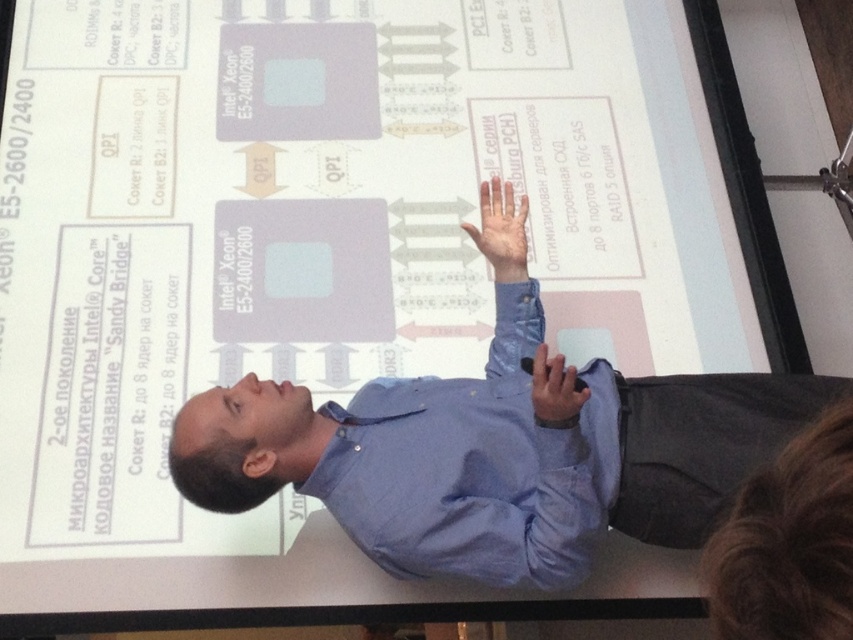
Question: Which point is farther to the camera?

Choices:
 (A) light brown skin at upper center
 (B) matte blue shirt at center

Answer: (A)

Question: Considering the real-world distances, which object is farthest from the matte blue shirt at center?

Choices:
 (A) blue shirt at center
 (B) light brown skin at upper center

Answer: (B)

Question: Can you confirm if light brown skin at upper center is wider than matte blue shirt at center?

Choices:
 (A) yes
 (B) no

Answer: (A)

Question: Can you confirm if blue shirt at center is bigger than matte blue shirt at center?

Choices:
 (A) yes
 (B) no

Answer: (A)

Question: Is blue shirt at center above matte blue shirt at center?

Choices:
 (A) yes
 (B) no

Answer: (B)

Question: Which object appears farthest from the camera in this image?

Choices:
 (A) light brown skin at upper center
 (B) matte blue shirt at center
 (C) blue shirt at center

Answer: (A)